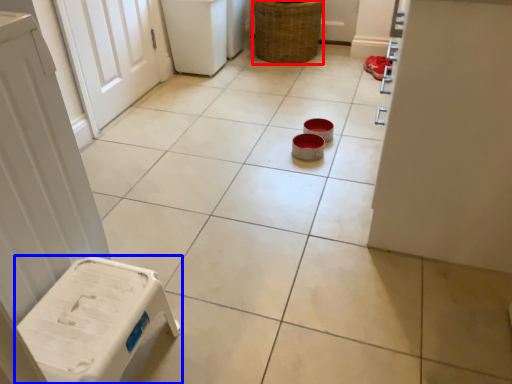
Question: Which object appears closest to the camera in this image, basket (highlighted by a red box) or furniture (highlighted by a blue box)?

Choices:
 (A) basket
 (B) furniture

Answer: (B)